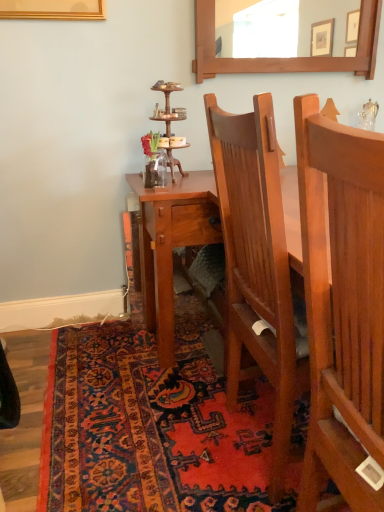
Question: From the image's perspective, is carpeted rug at lower center on light brown wood chair at center?

Choices:
 (A) no
 (B) yes

Answer: (A)

Question: Does carpeted rug at lower center turn towards light brown wood chair at center?

Choices:
 (A) yes
 (B) no

Answer: (B)

Question: Can we say carpeted rug at lower center lies outside light brown wood chair at center?

Choices:
 (A) yes
 (B) no

Answer: (A)

Question: Is the depth of carpeted rug at lower center greater than that of light brown wood chair at center?

Choices:
 (A) no
 (B) yes

Answer: (B)

Question: Considering the relative positions of carpeted rug at lower center and light brown wood chair at center in the image provided, is carpeted rug at lower center to the left of light brown wood chair at center from the viewer's perspective?

Choices:
 (A) yes
 (B) no

Answer: (A)

Question: From the image's perspective, relative to carpeted rug at lower center, is wooden mirror at upper center above or below?

Choices:
 (A) below
 (B) above

Answer: (B)

Question: Is wooden mirror at upper center spatially inside carpeted rug at lower center, or outside of it?

Choices:
 (A) outside
 (B) inside

Answer: (A)

Question: Considering the positions of wooden mirror at upper center and carpeted rug at lower center in the image, is wooden mirror at upper center taller or shorter than carpeted rug at lower center?

Choices:
 (A) short
 (B) tall

Answer: (B)

Question: Considering their positions, is wooden mirror at upper center located in front of or behind carpeted rug at lower center?

Choices:
 (A) front
 (B) behind

Answer: (B)

Question: In terms of size, does wooden mirror at upper center appear bigger or smaller than light brown wood chair at center?

Choices:
 (A) small
 (B) big

Answer: (A)

Question: Considering the positions of wooden mirror at upper center and light brown wood chair at center in the image, is wooden mirror at upper center taller or shorter than light brown wood chair at center?

Choices:
 (A) short
 (B) tall

Answer: (A)

Question: Choose the correct answer: Is wooden mirror at upper center inside light brown wood chair at center or outside it?

Choices:
 (A) outside
 (B) inside

Answer: (A)

Question: In the image, is wooden mirror at upper center positioned in front of or behind light brown wood chair at center?

Choices:
 (A) behind
 (B) front

Answer: (A)

Question: Considering the relative positions of carpeted rug at lower center and wooden mirror at upper center in the image provided, is carpeted rug at lower center to the left or to the right of wooden mirror at upper center?

Choices:
 (A) right
 (B) left

Answer: (B)

Question: Considering the positions of carpeted rug at lower center and wooden mirror at upper center in the image, is carpeted rug at lower center bigger or smaller than wooden mirror at upper center?

Choices:
 (A) small
 (B) big

Answer: (B)